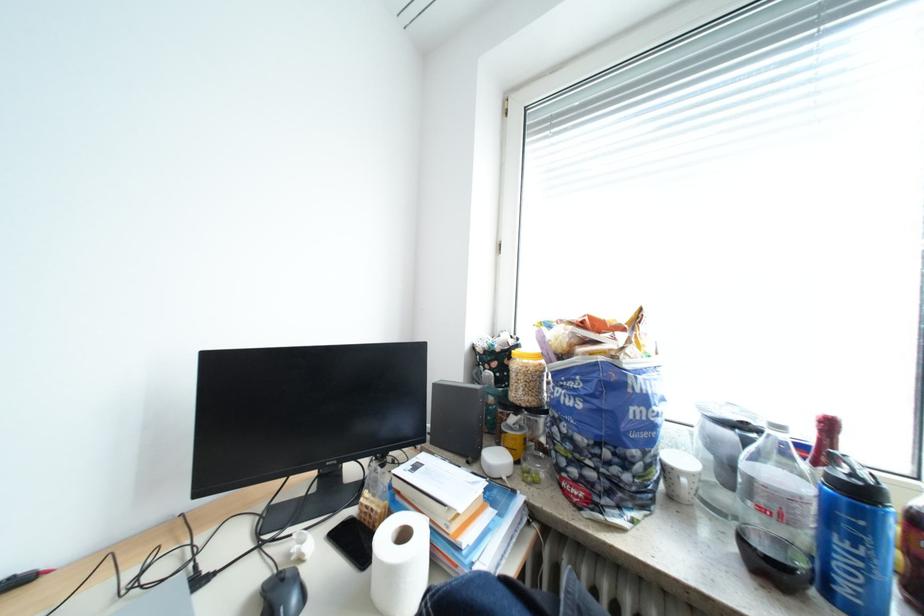
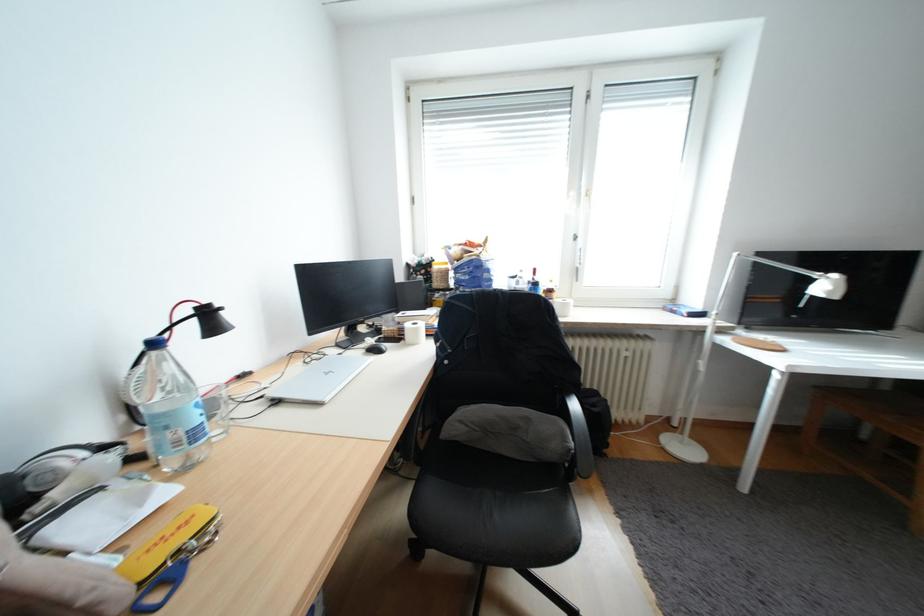
Question: The first image is from the beginning of the video and the second image is from the end. How did the camera likely rotate when shooting the video?

Choices:
 (A) Left
 (B) Right
 (C) Up
 (D) Down

Answer: (B)